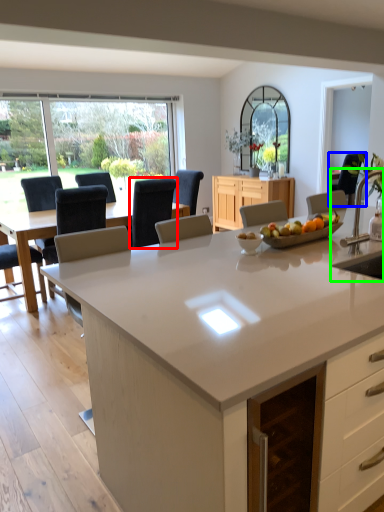
Question: Which object is positioned farthest from chair (highlighted by a red box)? Select from chair (highlighted by a blue box) and sink (highlighted by a green box).

Choices:
 (A) chair
 (B) sink

Answer: (A)